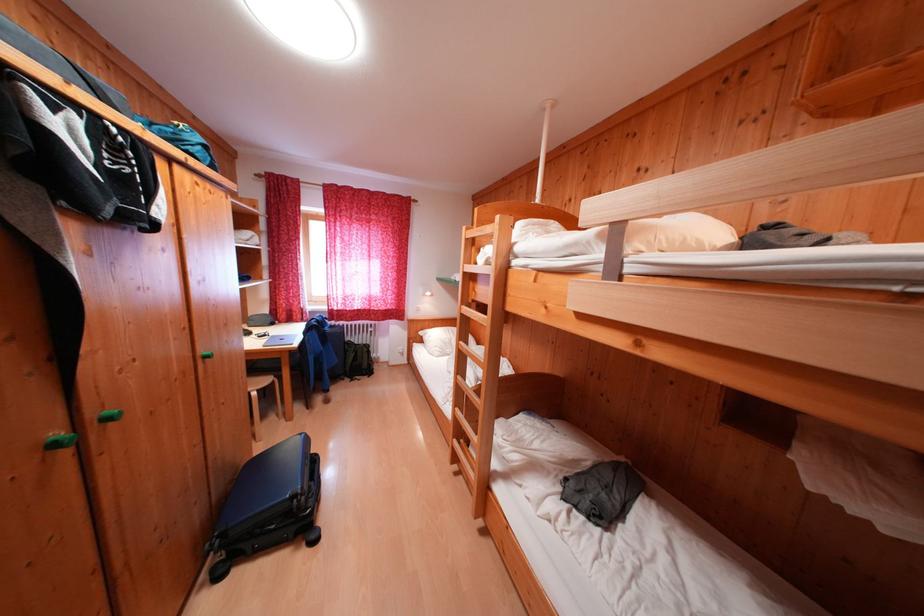
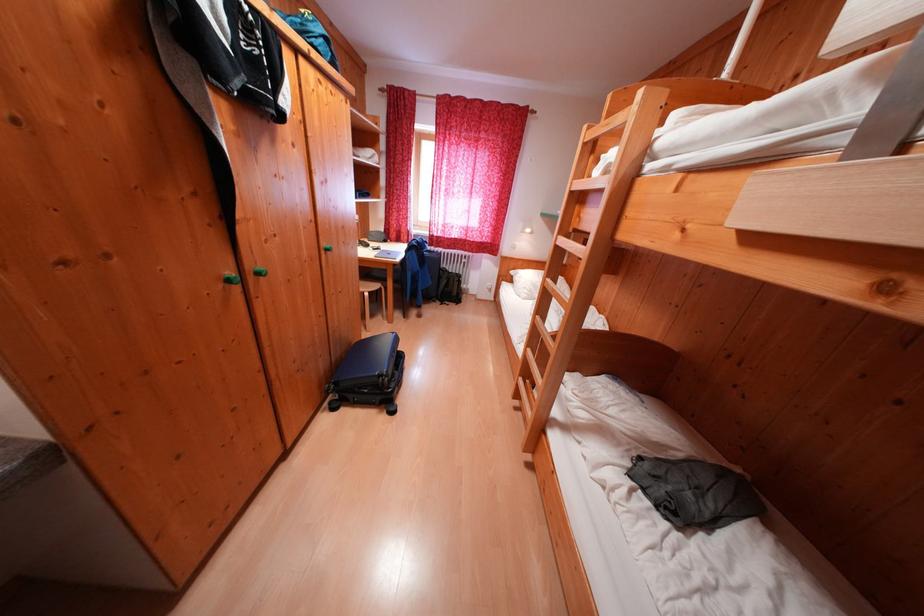
Locate, in the second image, the point that corresponds to point (466, 413) in the first image.

(537, 354)